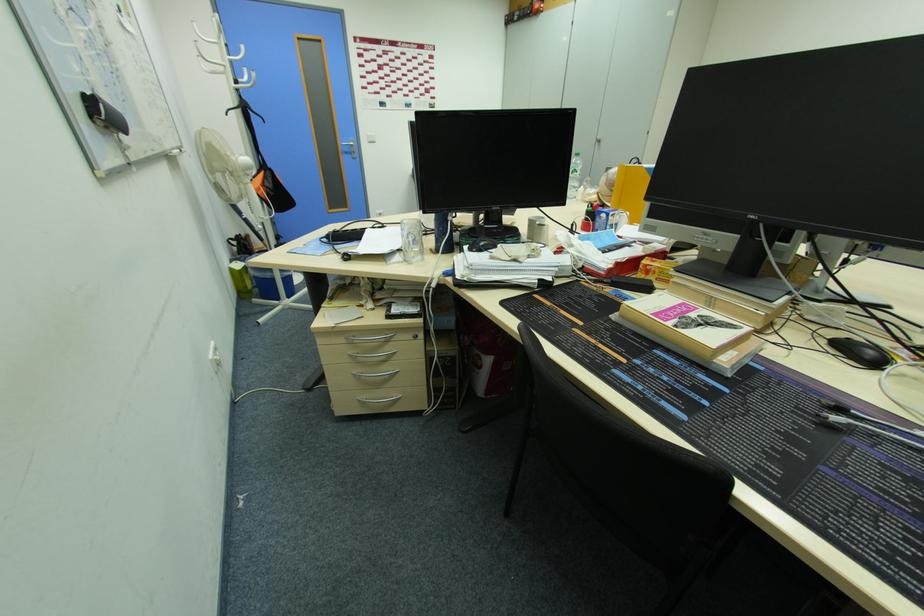
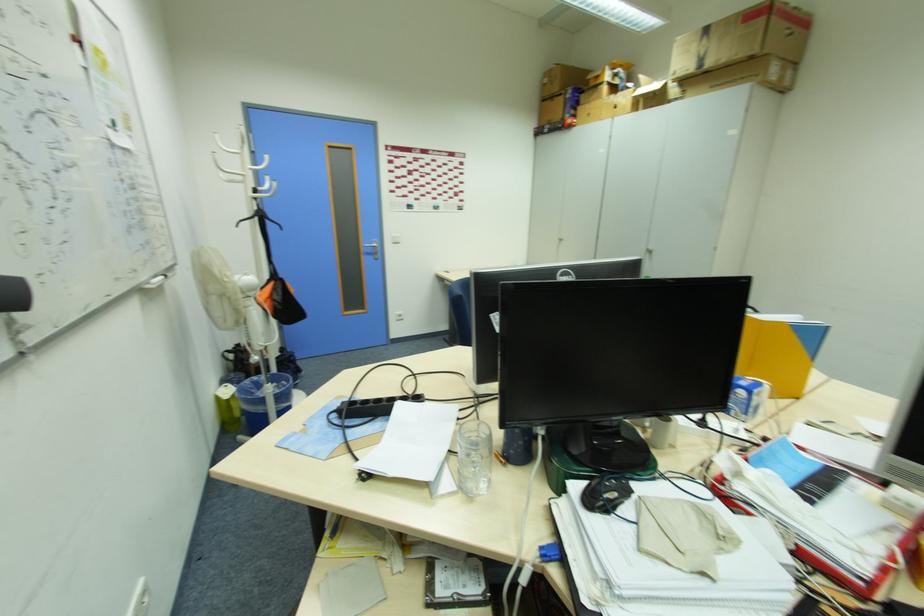
In the second image, find the point that corresponds to (x=346, y=144) in the first image.

(370, 245)